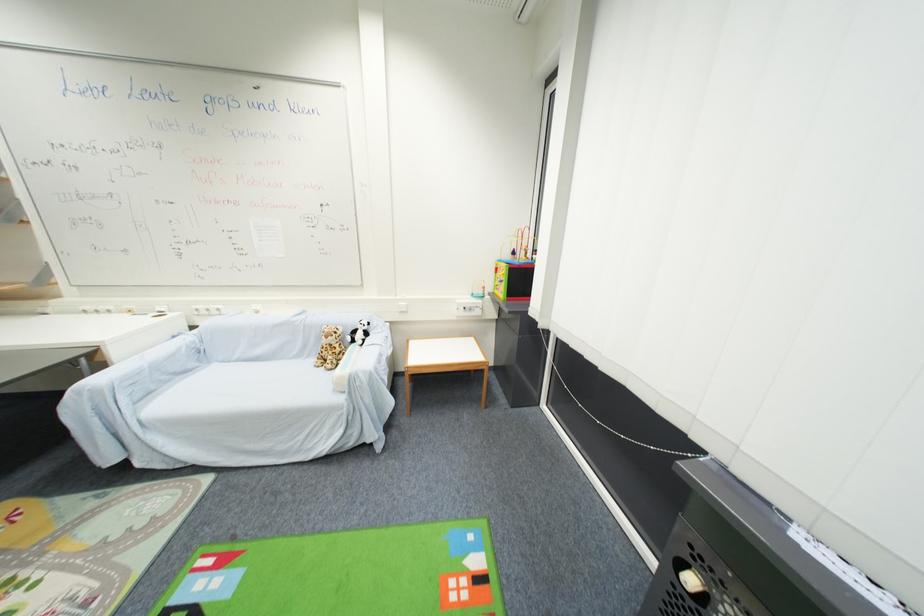
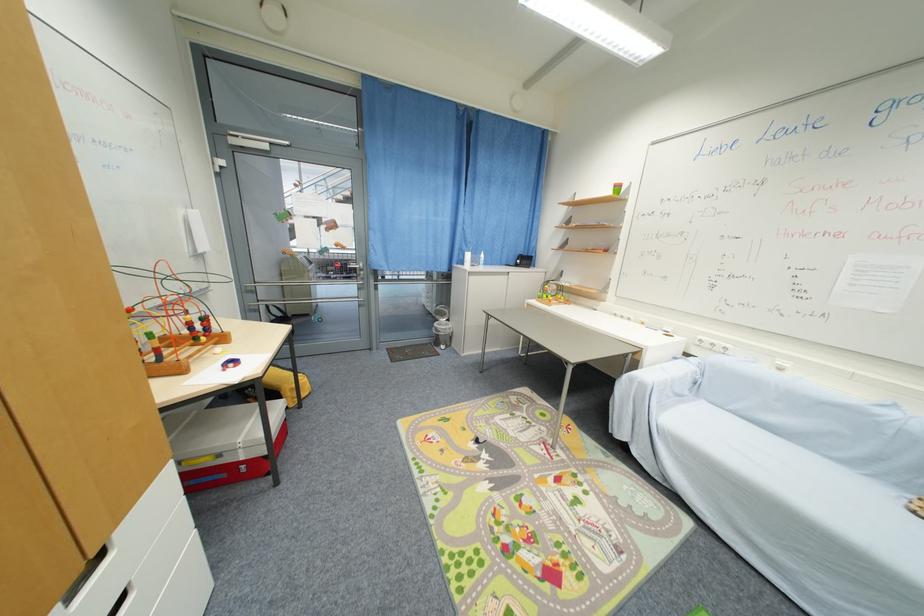
Question: The camera is either moving clockwise (left) or counter-clockwise (right) around the object. The first image is from the beginning of the video and the second image is from the end. Is the camera moving left or right when shooting the video?

Choices:
 (A) Left
 (B) Right

Answer: (B)